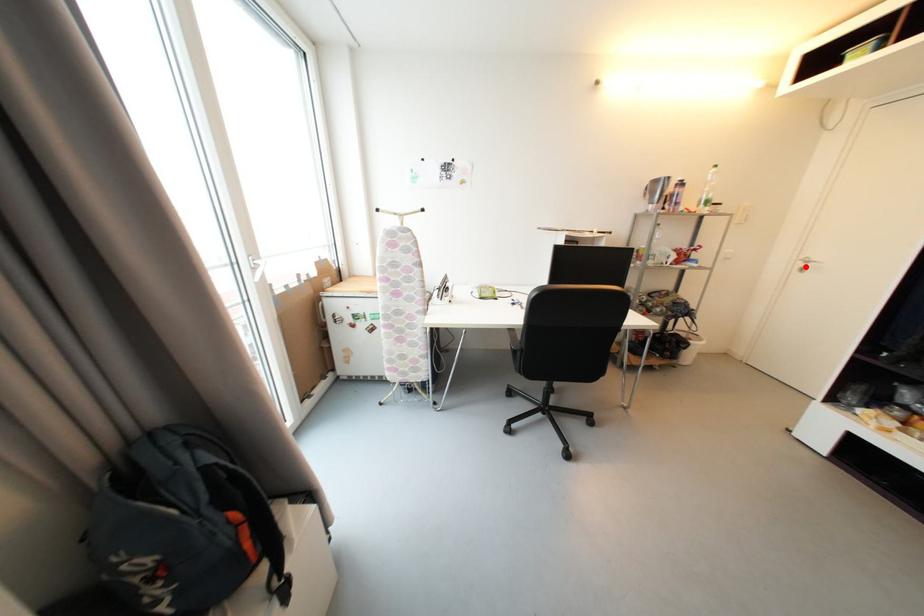
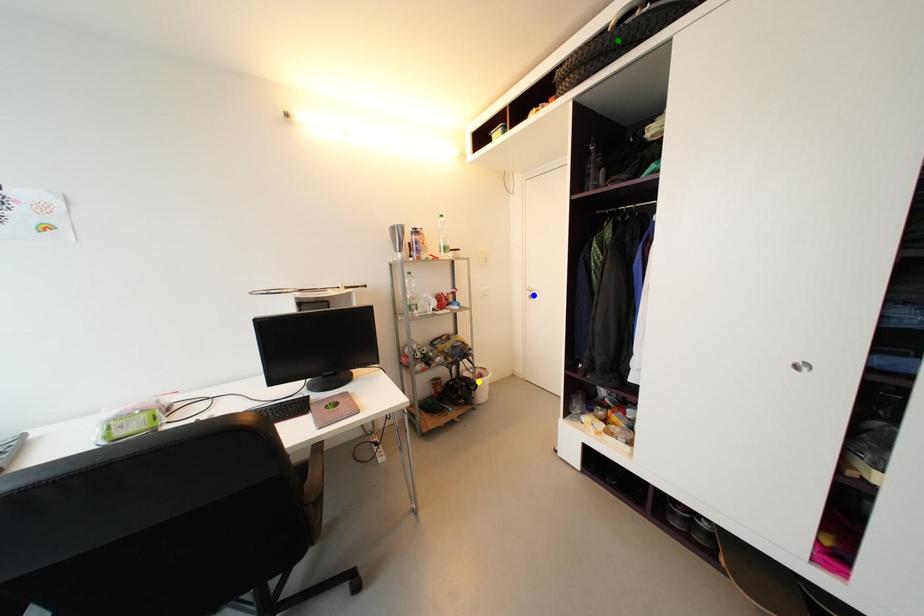
Question: I am providing you with two images of the same scene from different viewpoints. A red point is marked on the first image. You are given multiple points on the second image. In image 2, which mark is for the same physical point as the one in image 1?

Choices:
 (A) blue point
 (B) green point
 (C) yellow point

Answer: (A)